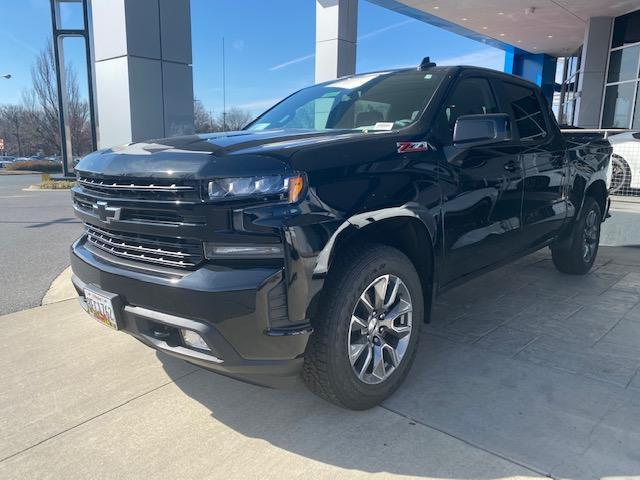
In order to click on door in this screenshot , I will do `click(502, 181)`, `click(540, 178)`.